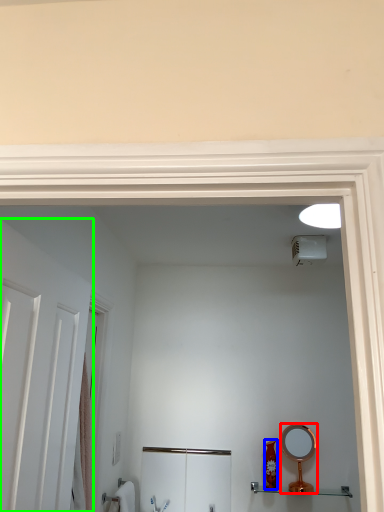
Question: Which object is the closest to the mirror (highlighted by a red box)? Choose among these: toiletry (highlighted by a blue box) or door (highlighted by a green box).

Choices:
 (A) toiletry
 (B) door

Answer: (A)